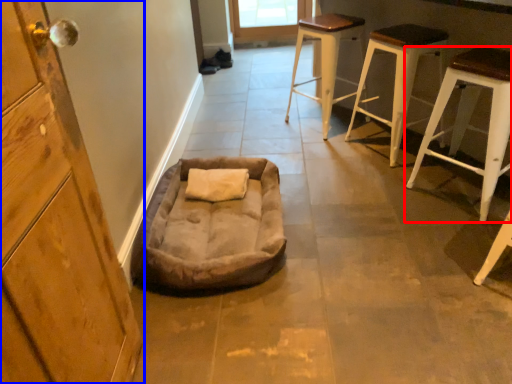
Question: Among these objects, which one is farthest to the camera, stool (highlighted by a red box) or cabinetry (highlighted by a blue box)?

Choices:
 (A) stool
 (B) cabinetry

Answer: (A)